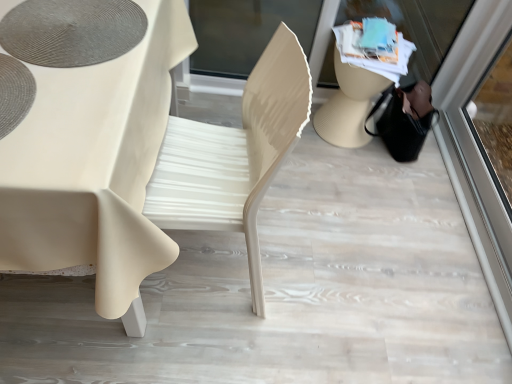
The width and height of the screenshot is (512, 384). In order to click on vacant space in front of transparent glass shop window at upper right in this screenshot , I will do `click(354, 222)`.